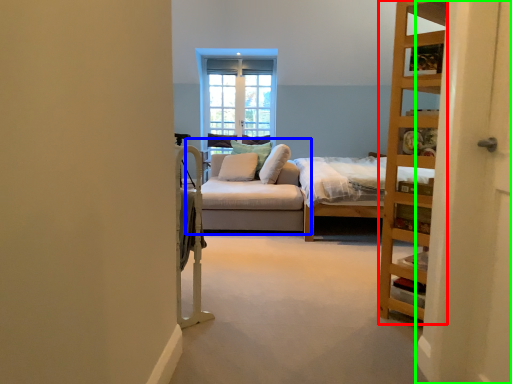
Question: Considering the real-world distances, which object is closest to shelf (highlighted by a red box)? studio couch (highlighted by a blue box) or screen door (highlighted by a green box).

Choices:
 (A) studio couch
 (B) screen door

Answer: (B)